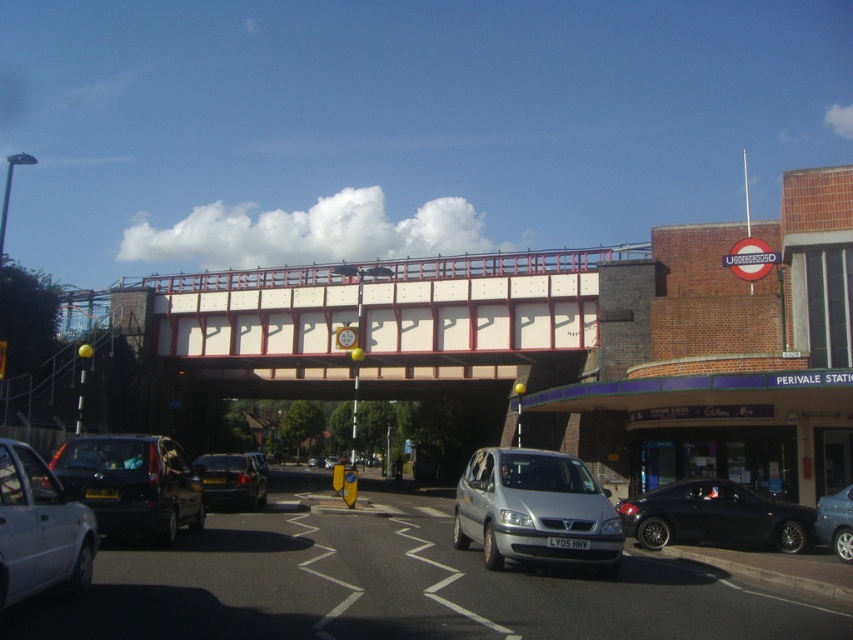
You are a delivery driver who needs to park your car in a space that can only accommodate vehicles smaller than your current vehicle. You observe the silver metallic car at lower left and the black matte car at lower right in the scene. Which car should you choose to park in the space if you want to fit?

The silver metallic car at lower left is smaller than the black matte car at lower right, so you should choose the parking space where the silver metallic car at lower left is parked to ensure it fits.

You are standing at the location where the image was taken and want to cross the road to reach the PERIVALE STATION building. There is a silver metallic car at lower left blocking your path. Can you safely walk around the car to reach the road? Please consider the distance between you and the car.

The silver metallic car at lower left is 5.85 meters away from you. Since this distance is sufficient to walk around the car safely, you can proceed to cross the road by going around the silver metallic car at lower left.

You are standing at the center of the street scene and want to locate the matte black van at lower left. According to the coordinates provided, in which direction should you look to find it?

The matte black van at lower left is located at point coordinates (134,483), so you should look to the lower left direction to find it.